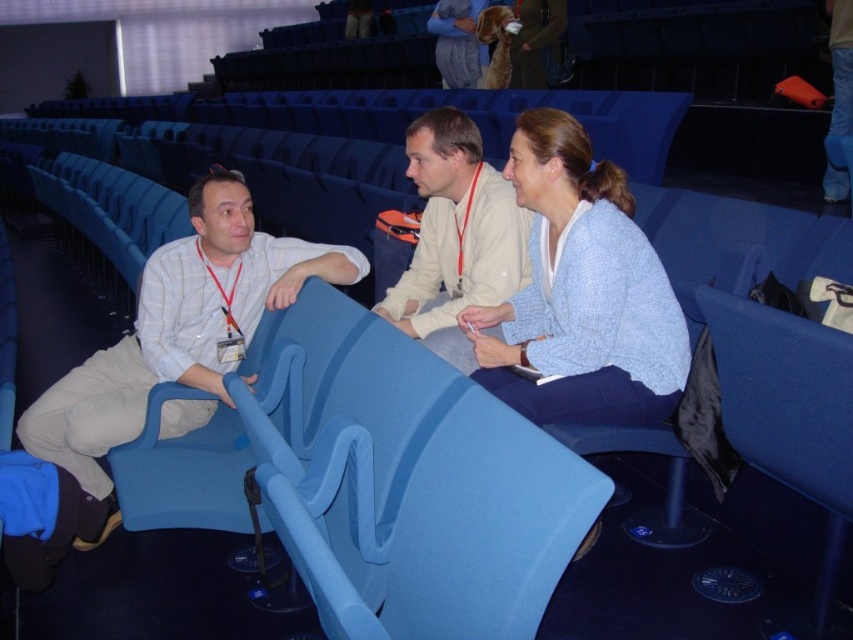
You are an event organizer who needs to seat guests according to their ticket sizes. The white striped shirt at left and light beige shirt at center are both holding tickets. Which guest should you seat in the larger seat based on their clothing size?

The white striped shirt at left should be seated in the larger seat because the white striped shirt at left is larger in size than the light beige shirt at center.

In the scene shown: Please provide the coordinates of the light blue knit sweater at center in the auditorium scene described. The scene includes three people seated in blue, modern seats arranged in upward sloping rows. The sweater is part of the middle individual.

The light blue knit sweater at center is located at coordinates point (579, 292).

You are sitting in the back row of the auditorium and want to get the attention of the person wearing the light blue knit sweater at center and the person wearing the white striped shirt at left. Which person is closer to the left side of the auditorium?

The white striped shirt at left is closer to the left side of the auditorium because the light blue knit sweater at center is to the right of the white striped shirt at left.